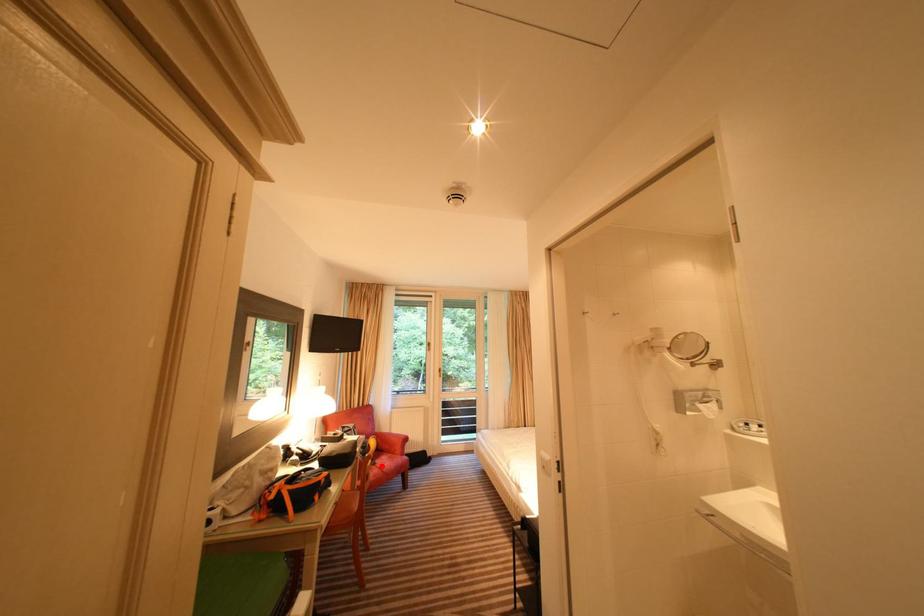
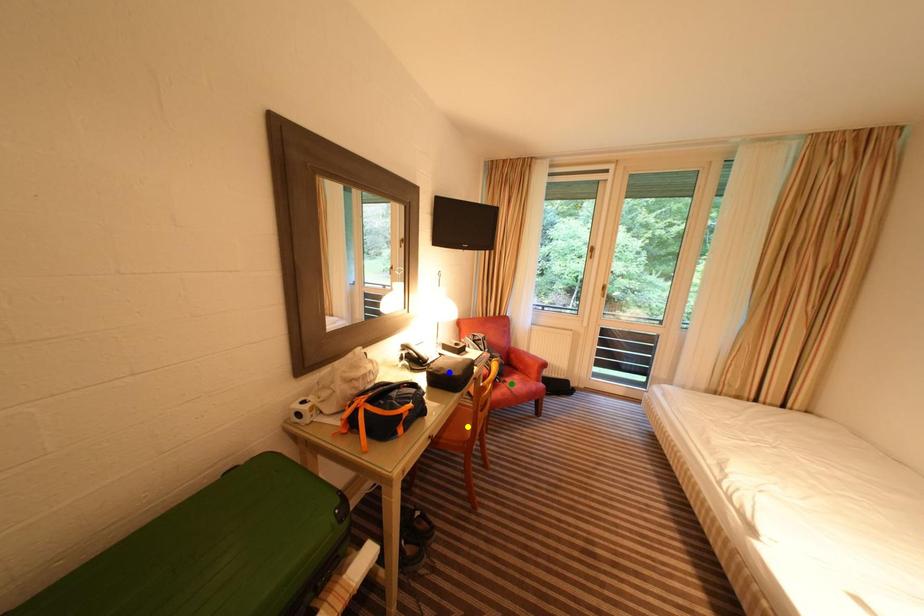
Question: I am providing you with two images of the same scene from different viewpoints. A red point is marked on the first image. You are given multiple points on the second image. Which point in image 2 represents the same 3d spot as the red point in image 1?

Choices:
 (A) yellow point
 (B) green point
 (C) blue point

Answer: (B)